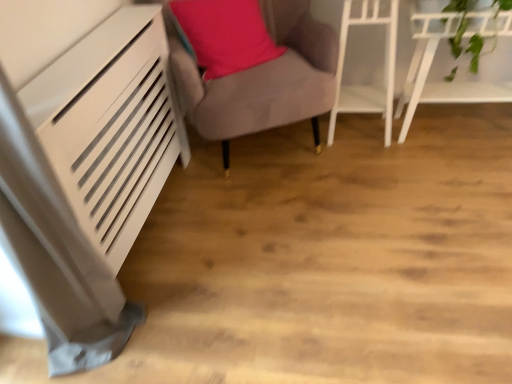
Where is `vacant area that lies in front of white glossy shelf at upper right, acting as the second furniture starting from the right`? vacant area that lies in front of white glossy shelf at upper right, acting as the second furniture starting from the right is located at coordinates (374, 162).